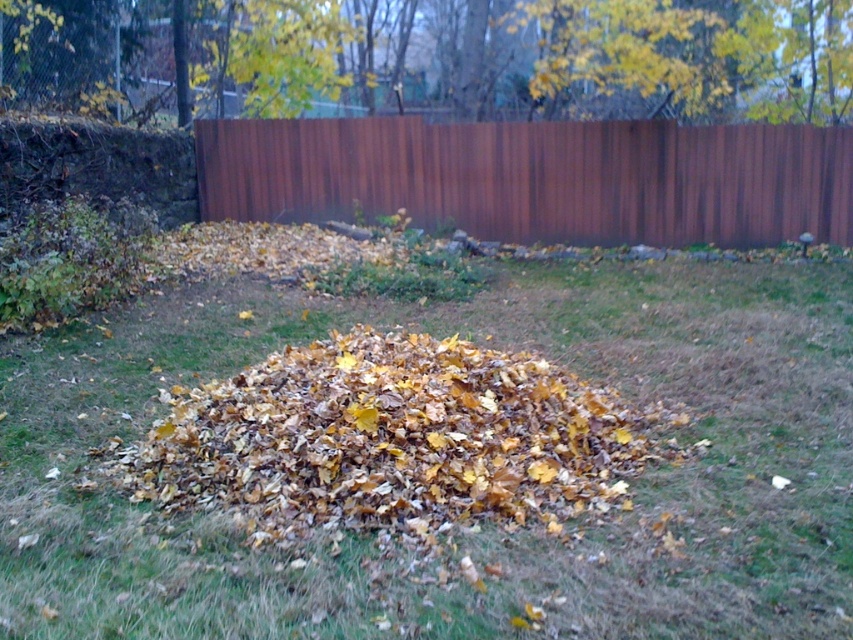
Question: Observing the image, what is the correct spatial positioning of brown dry grass at center in reference to brown wood fence at center?

Choices:
 (A) right
 (B) left

Answer: (A)

Question: Among these objects, which one is nearest to the camera?

Choices:
 (A) yellow-green leaves at upper center
 (B) brown wood fence at center

Answer: (A)

Question: Can you confirm if brown dry grass at center is wider than brown wood fence at center?

Choices:
 (A) yes
 (B) no

Answer: (B)

Question: Is brown dry grass at center to the right of yellow-green leaves at upper center from the viewer's perspective?

Choices:
 (A) no
 (B) yes

Answer: (A)

Question: Which object is farther from the camera taking this photo?

Choices:
 (A) yellow-green leaves at upper center
 (B) brown wood fence at center

Answer: (B)

Question: Which object is positioned farthest from the yellow-green leaves at upper center?

Choices:
 (A) brown dry grass at center
 (B) brown wood fence at center

Answer: (A)